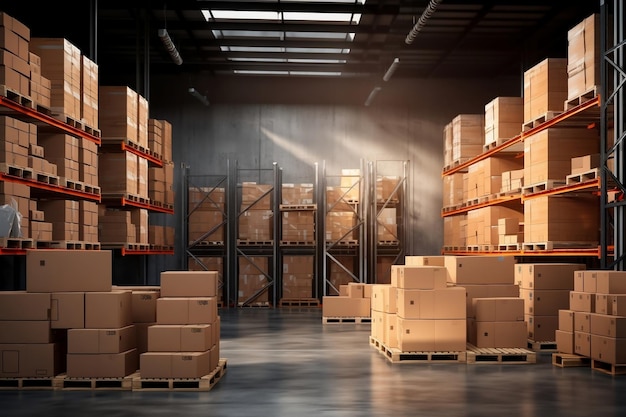
Image resolution: width=626 pixels, height=417 pixels. I want to click on skylights, so click(320, 15), click(258, 13), click(250, 26), click(313, 31), click(320, 46), click(268, 45), click(255, 58), click(317, 58), click(320, 66), click(263, 66).